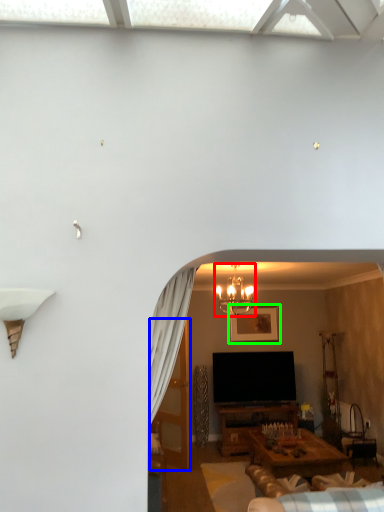
Question: Which is nearer to the light fixture (highlighted by a red box)? glass door (highlighted by a blue box) or picture frame (highlighted by a green box).

Choices:
 (A) glass door
 (B) picture frame

Answer: (B)